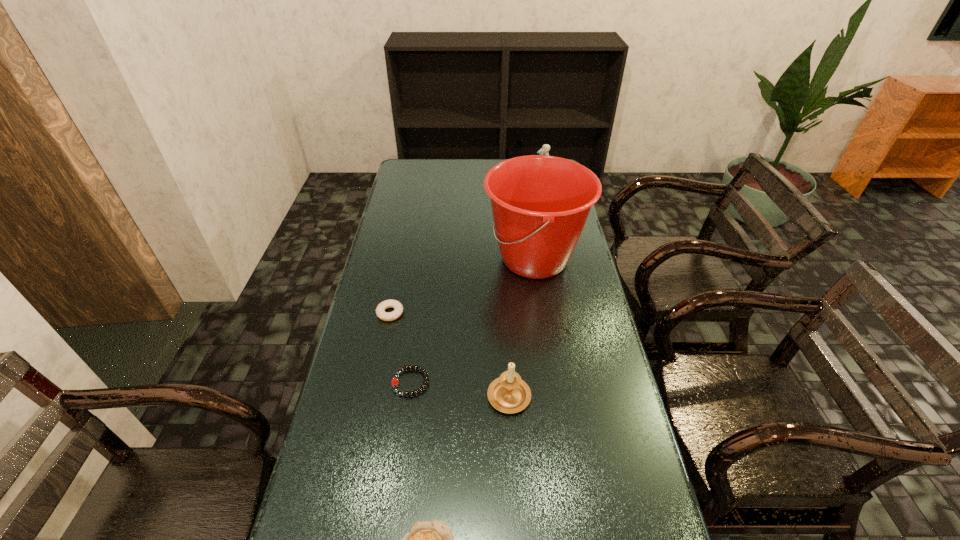
Identify the location of the tallest object. (540, 204).

Locate an element on the screen. The height and width of the screenshot is (540, 960). bucket is located at coordinates (540, 204).

Locate an element on the screen. the fifth shortest object is located at coordinates tap(544, 150).

Find the location of a particular element. Image resolution: width=960 pixels, height=540 pixels. figurine is located at coordinates click(x=544, y=150).

Where is `candle holder`? candle holder is located at coordinates (509, 393).

Locate an element on the screen. This screenshot has width=960, height=540. the leftmost object is located at coordinates (398, 308).

This screenshot has height=540, width=960. In order to click on doughnut in this screenshot , I will do `click(398, 308)`.

At what (x,y) coordinates should I click in order to perform the action: click on bracelet. Please return your answer as a coordinate pair (x, y). Looking at the image, I should click on (395, 381).

Where is `vacant region located 0.090m with the handle attached to the rim of the tallest object`? vacant region located 0.090m with the handle attached to the rim of the tallest object is located at coordinates (458, 259).

Identify the location of vacant space located 0.360m with the handle attached to the rim of the tallest object. (383, 259).